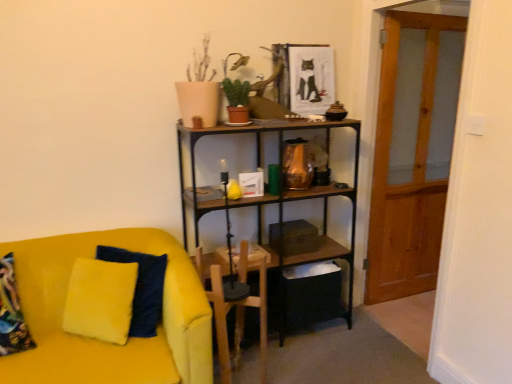
Question: Visually, is velvet yellow couch at left positioned to the left or to the right of green matte plant at upper center?

Choices:
 (A) left
 (B) right

Answer: (A)

Question: From a real-world perspective, is velvet yellow couch at left positioned above or below green matte plant at upper center?

Choices:
 (A) above
 (B) below

Answer: (B)

Question: Based on their relative distances, which object is nearer to the green matte plant at upper center?

Choices:
 (A) velvet yellow couch at left
 (B) transparent wooden door at right
 (C) wooden armchair at center

Answer: (C)

Question: Which of these objects is positioned farthest from the velvet yellow couch at left?

Choices:
 (A) transparent wooden door at right
 (B) green matte plant at upper center
 (C) wooden armchair at center

Answer: (A)